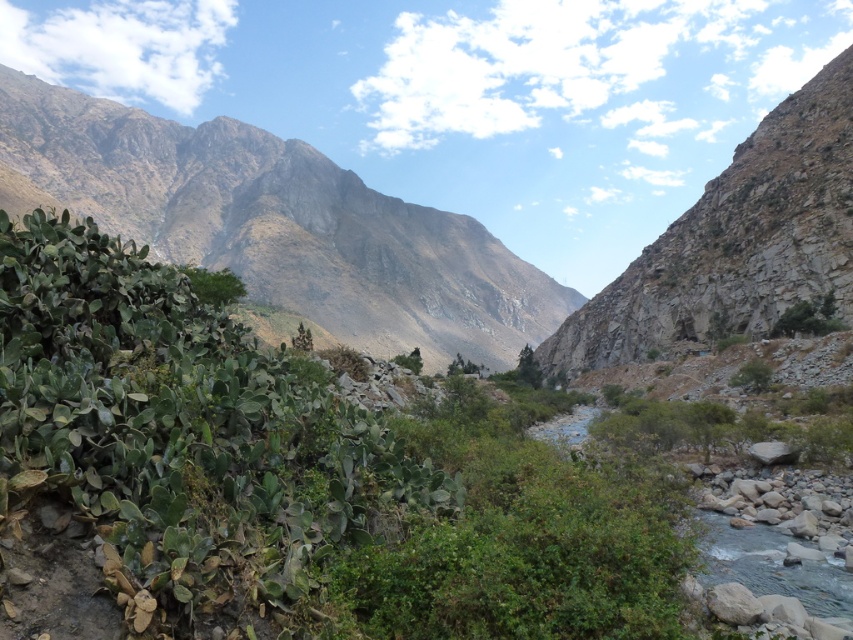
You are planning to hike from the valley floor to the top of the gray rocky mountain at upper center and the rocky cliff at upper right. Which destination requires climbing a taller structure?

The gray rocky mountain at upper center requires climbing a taller structure because it is larger in size than the rocky cliff at upper right.

You are a hiker planning to cross the valley. You need to choose between the gray rocky mountain at upper center and the rocky cliff at upper right as your path. Considering their widths, which path would allow you to walk more comfortably?

The gray rocky mountain at upper center has a greater width than the rocky cliff at upper right, so the path on the gray rocky mountain at upper center would allow for more comfortable walking due to its wider terrain.

You are a hiker planning to take a photo of the gray rocky mountain at upper center and the rocky cliff at upper right. Which object should you position closer to the camera to ensure both are in the frame?

You should position the rocky cliff at upper right closer to the camera because the gray rocky mountain at upper center is positioned over it, meaning it is farther away. This way, both the gray rocky mountain at upper center and the rocky cliff at upper right will be in the frame.